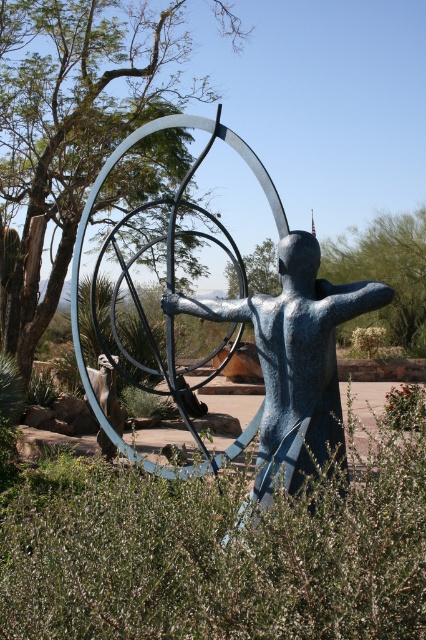
Question: Which point is closer to the camera taking this photo?

Choices:
 (A) (255, 332)
 (B) (161, 108)

Answer: (A)

Question: Which object is the farthest from the green leafy tree at upper left?

Choices:
 (A) blue polished metal statue at center
 (B) green leafy bush at center
 (C) green leafy tree at upper right

Answer: (C)

Question: Is blue polished metal statue at center behind green leafy tree at upper right?

Choices:
 (A) no
 (B) yes

Answer: (A)

Question: Can you confirm if green leafy tree at upper left is thinner than blue polished metal statue at center?

Choices:
 (A) no
 (B) yes

Answer: (A)

Question: Among these points, which one is farthest from the camera?

Choices:
 (A) (11, 284)
 (B) (311, 307)
 (C) (411, 332)
 (D) (181, 524)

Answer: (C)

Question: Does blue polished metal statue at center appear on the left side of green leafy tree at upper right?

Choices:
 (A) yes
 (B) no

Answer: (A)